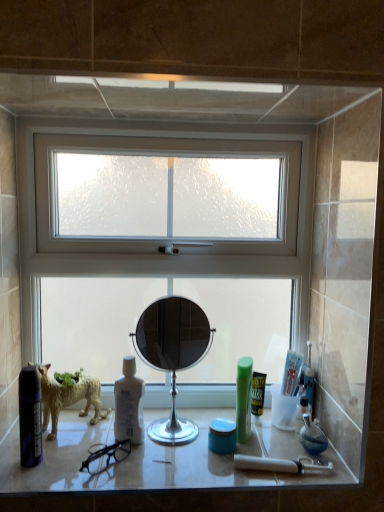
What are the coordinates of `free spot to the left of white glossy mouthwash at center, the 1th mouthwash viewed from the left` in the screenshot? It's located at (71, 454).